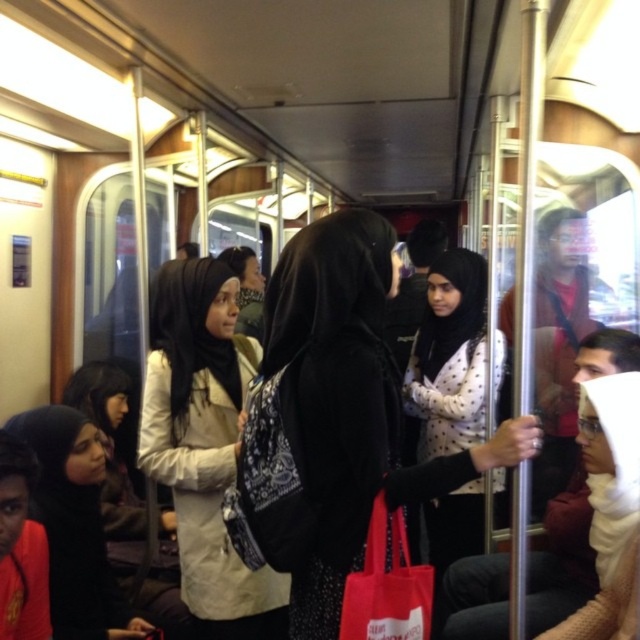
Question: Is beige fabric hijab at center to the right of white knit cap at upper right from the viewer's perspective?

Choices:
 (A) no
 (B) yes

Answer: (A)

Question: Which point is closer to the camera taking this photo?

Choices:
 (A) (243, 452)
 (B) (472, 337)

Answer: (A)

Question: Which object appears farthest from the camera in this image?

Choices:
 (A) black fabric hijab at center
 (B) white knit cap at upper right
 (C) beige fabric hijab at center
 (D) white dotted shirt at center

Answer: (D)

Question: Which point appears closest to the camera in this image?

Choices:
 (A) (436, 538)
 (B) (84, 561)
 (C) (177, 513)
 (D) (506, 464)

Answer: (D)

Question: Does black fabric hijab at lower left have a greater width compared to white knit cap at upper right?

Choices:
 (A) no
 (B) yes

Answer: (B)

Question: Is beige fabric hijab at center below white knit cap at upper right?

Choices:
 (A) no
 (B) yes

Answer: (A)